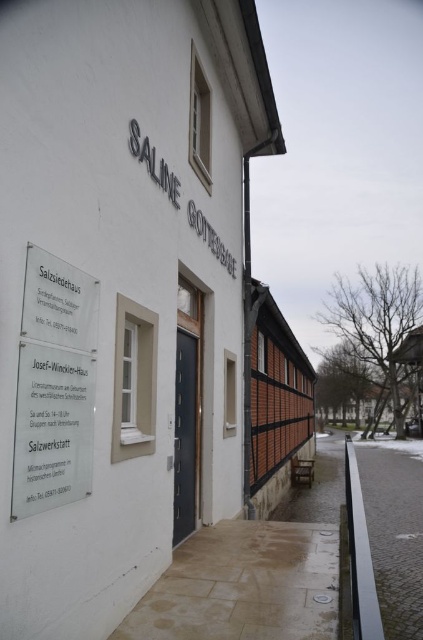
Based on the photo, you are standing in front of the Saline Gottesbau building and want to touch the point at coordinates (73, 342) on the wall. Can you reach it without moving closer?

The point at coordinates (73, 342) is 3.12 meters away from the viewer. Since the average arm length is about 0.7 meters, you cannot reach it without moving closer.

You are standing in front of the building labeled SALINE GOTTESBAUDE and looking at the two points marked on its facade. Which point, point (18, 412) or point (189, 452), is closer to you?

Point (18, 412) is closer to you than point (189, 452).